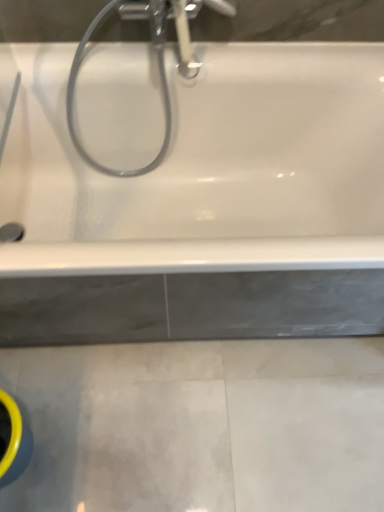
Question: Considering the positions of chrome metallic showerhead at upper center and satin nickel faucet at upper center in the image, is chrome metallic showerhead at upper center wider or thinner than satin nickel faucet at upper center?

Choices:
 (A) wide
 (B) thin

Answer: (B)

Question: Relative to satin nickel faucet at upper center, is chrome metallic showerhead at upper center in front or behind?

Choices:
 (A) front
 (B) behind

Answer: (A)

Question: Estimate the real-world distances between objects in this image. Which object is farther from the chrome metallic showerhead at upper center?

Choices:
 (A) satin nickel faucet at upper center
 (B) white glossy bathtub at upper center

Answer: (B)

Question: Which object is the farthest from the satin nickel faucet at upper center?

Choices:
 (A) white glossy bathtub at upper center
 (B) chrome metallic showerhead at upper center

Answer: (A)